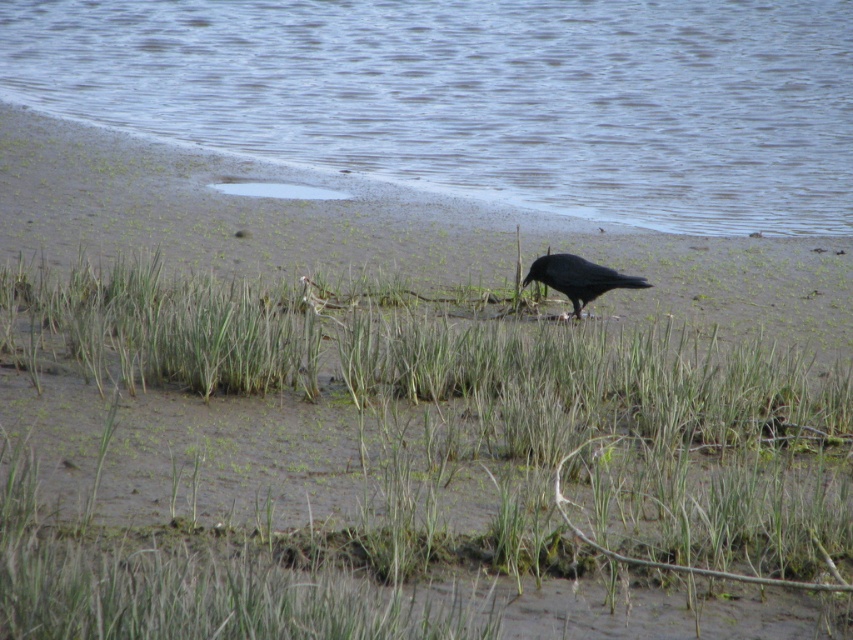
Question: Among these points, which one is farthest from the camera?

Choices:
 (A) (746, 74)
 (B) (339, 609)
 (C) (627, 282)

Answer: (A)

Question: Is green grass at center in front of clear water at lower left?

Choices:
 (A) yes
 (B) no

Answer: (A)

Question: Which of the following is the closest to the observer?

Choices:
 (A) clear water at lower left
 (B) shiny black crow at center

Answer: (B)

Question: Can you confirm if green grass at center is positioned to the right of shiny black crow at center?

Choices:
 (A) yes
 (B) no

Answer: (B)

Question: Can you confirm if green grass at center is positioned above clear water at lower left?

Choices:
 (A) yes
 (B) no

Answer: (B)

Question: Which point is closer to the camera?

Choices:
 (A) green grass at center
 (B) clear water at lower left
 (C) shiny black crow at center

Answer: (A)